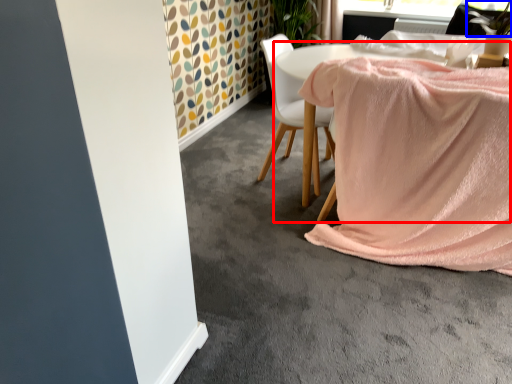
Question: Which object is further to the camera taking this photo, table (highlighted by a red box) or plant (highlighted by a blue box)?

Choices:
 (A) table
 (B) plant

Answer: (B)